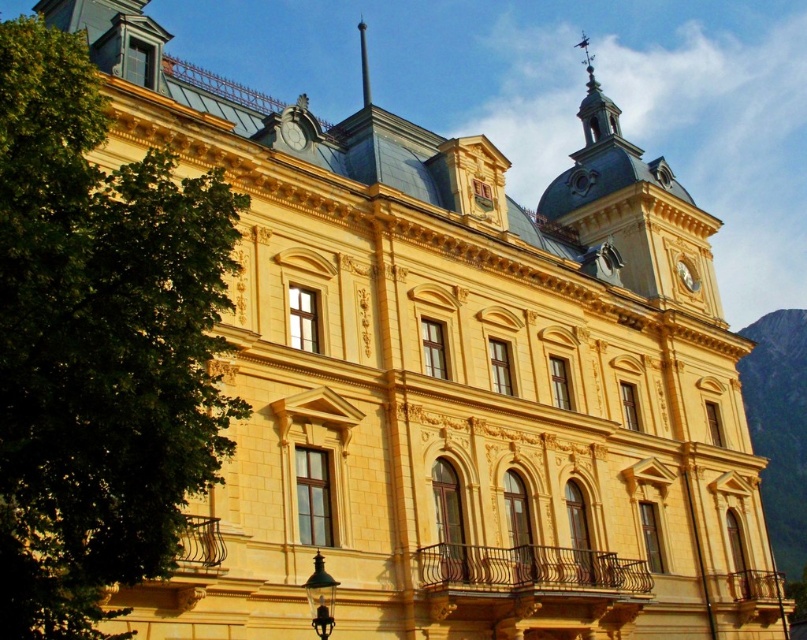
Does green leafy tree at left have a greater width compared to gold metallic clock at upper center?

Yes.

Which is in front, point (82, 161) or point (684, 262)?

Positioned in front is point (82, 161).

Who is more forward, (132, 452) or (690, 282)?

Point (132, 452) is in front.

Where is `green leafy tree at left`? green leafy tree at left is located at coordinates (98, 344).

Between point (303, 140) and point (684, 259), which one is positioned behind?

Point (684, 259)

Is point (295, 128) positioned behind point (688, 272)?

That is False.

This screenshot has width=807, height=640. I want to click on matte gold clock at upper center, so click(x=293, y=134).

Who is more distant from viewer, [95,186] or [289,141]?

Positioned behind is point [289,141].

Based on the photo, does green leafy tree at left have a lesser width compared to matte gold clock at upper center?

Incorrect, green leafy tree at left's width is not less than matte gold clock at upper center's.

Does point (59, 356) come closer to viewer compared to point (287, 124)?

Yes, point (59, 356) is in front of point (287, 124).

What are the coordinates of `green leafy tree at left` in the screenshot? It's located at (98, 344).